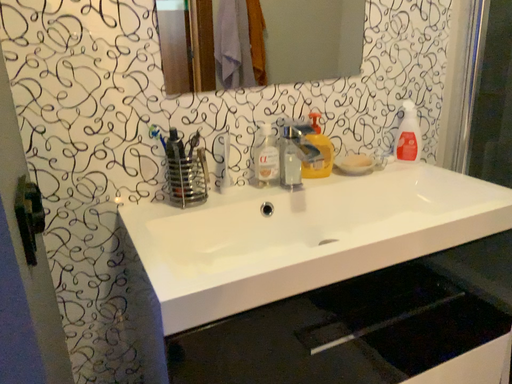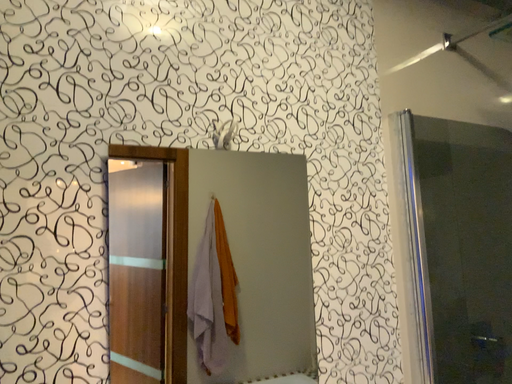
Question: How did the camera likely rotate when shooting the video?

Choices:
 (A) rotated downward
 (B) rotated upward

Answer: (B)